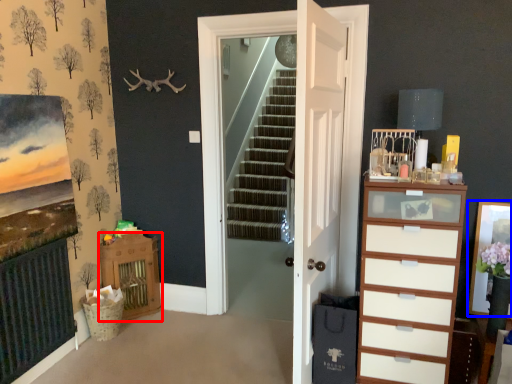
Question: Among these objects, which one is farthest to the camera, vanity (highlighted by a red box) or picture frame (highlighted by a blue box)?

Choices:
 (A) vanity
 (B) picture frame

Answer: (A)